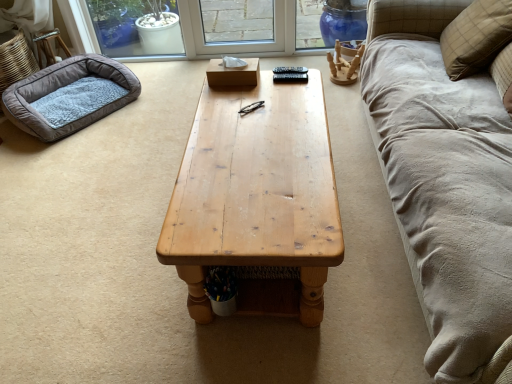
This screenshot has width=512, height=384. Find the location of `free space in front of soft gray fleece dog bed at left`. free space in front of soft gray fleece dog bed at left is located at coordinates (77, 162).